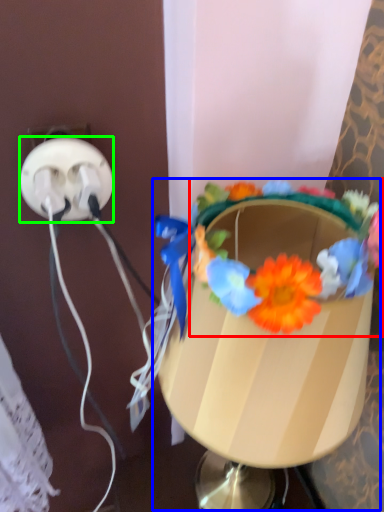
Question: Which object is positioned closest to flower (highlighted by a red box)? Select from table lamp (highlighted by a blue box) and power plugs and sockets (highlighted by a green box).

Choices:
 (A) table lamp
 (B) power plugs and sockets

Answer: (A)